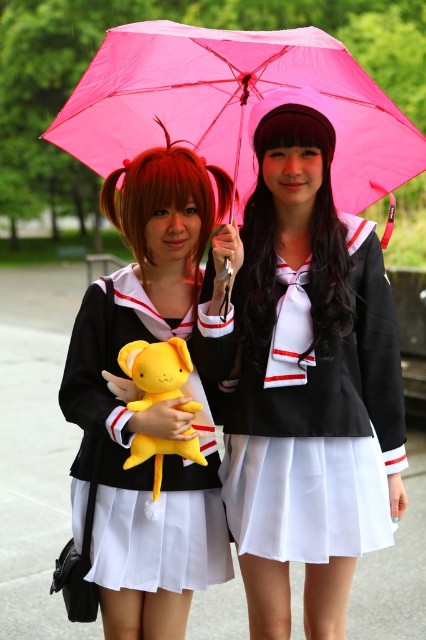
Which is in front, point (154, 529) or point (176, 396)?

Positioned in front is point (176, 396).

At what (x,y) coordinates should I click in order to perform the action: click on matte black dress at center. Please return your answer as a coordinate pair (x, y). The height and width of the screenshot is (640, 426). Looking at the image, I should click on (149, 406).

Describe the element at coordinates (149, 406) in the screenshot. I see `matte black dress at center` at that location.

The width and height of the screenshot is (426, 640). Find the location of `matte black dress at center`. matte black dress at center is located at coordinates (149, 406).

Looking at this image, which is below, satin black uniform at center or yellow plush toy at center?

yellow plush toy at center is lower down.

Between satin black uniform at center and yellow plush toy at center, which one has more height?

Answer: Standing taller between the two is satin black uniform at center.

Find the location of `satin black uniform at center`. satin black uniform at center is located at coordinates (308, 380).

Does matte black dress at center have a lesser height compared to pink fabric umbrella at upper center?

Incorrect, matte black dress at center's height does not fall short of pink fabric umbrella at upper center's.

From the picture: Is matte black dress at center further to camera compared to pink fabric umbrella at upper center?

Yes.

Between point (172, 509) and point (373, 154), which one is positioned behind?

Positioned behind is point (373, 154).

This screenshot has width=426, height=640. Find the location of `matte black dress at center`. matte black dress at center is located at coordinates (149, 406).